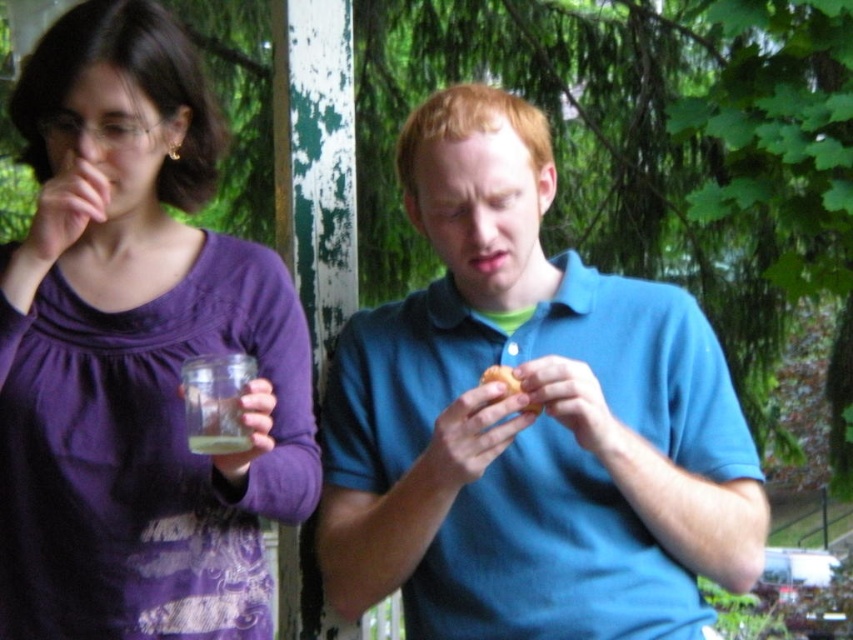
You are a photographer trying to take a clear picture of the yellow matte donut at center without the blue cotton shirt at center blocking it. What should you do?

The blue cotton shirt at center is in front of the yellow matte donut at center, so you should move the blue cotton shirt at center out of the way or adjust your angle to avoid the obstruction.

You are a photographer trying to capture a closeup of the yellow matte donut at center without the blue cotton shirt at center blocking the view. Is the donut visible in the shot?

The blue cotton shirt at center is located above the yellow matte donut at center, so the shirt may block the view of the donut. Adjust your angle or position to ensure the donut is visible.